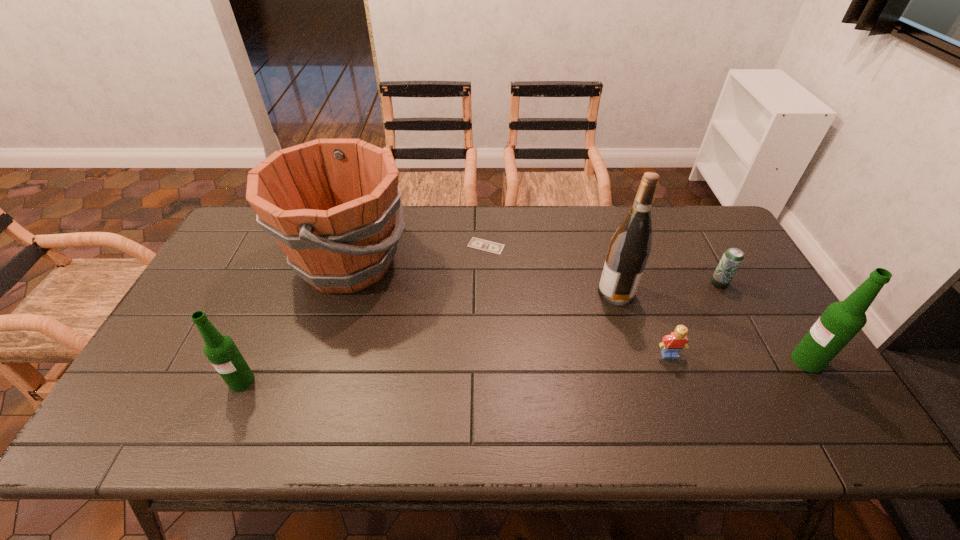
Locate an element on the screen. The width and height of the screenshot is (960, 540). money situated at the far edge is located at coordinates (476, 243).

You are a GUI agent. You are given a task and a screenshot of the screen. Output one action in this format:
    pyautogui.click(x=<x>, y=<y>)
    Task: Click on the beer bottle present at the right edge
    The height and width of the screenshot is (540, 960).
    Given the screenshot: What is the action you would take?
    pyautogui.click(x=841, y=321)

Where is `beer can that is at the right edge`? beer can that is at the right edge is located at coordinates (732, 258).

Find the location of a particular element. object that is positioned at the near right corner is located at coordinates (841, 321).

The width and height of the screenshot is (960, 540). I want to click on vacant region at the far edge of the desktop, so click(x=445, y=219).

Where is `free space at the near edge`? free space at the near edge is located at coordinates (243, 395).

At what (x,y) coordinates should I click in order to perform the action: click on vacant space at the left edge. Please return your answer as a coordinate pair (x, y). The image size is (960, 540). Looking at the image, I should click on (207, 279).

At what (x,y) coordinates should I click in order to perform the action: click on free space at the right edge. Please return your answer as a coordinate pair (x, y). The height and width of the screenshot is (540, 960). Looking at the image, I should click on (749, 338).

What are the coordinates of `free space at the far right corner of the desktop` in the screenshot? It's located at (732, 239).

I want to click on free point between the shorter beer bottle and the bucket, so click(x=295, y=322).